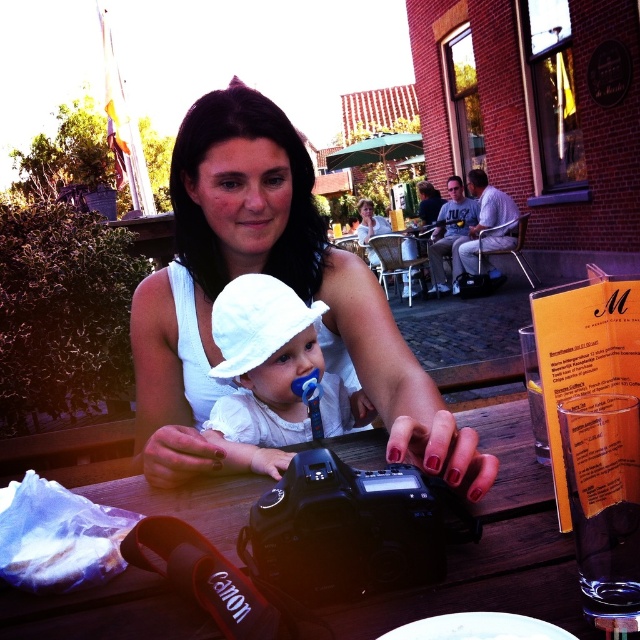
Does wooden table at center have a lesser width compared to white fabric hat at center?

No.

Between point (488, 406) and point (250, 301), which one is positioned behind?

Positioned behind is point (488, 406).

In order to click on wooden table at center in this screenshot , I will do `click(492, 547)`.

Consider the image. Which of these two, white matte shirt at center or white paper bag at lower left, stands taller?

white matte shirt at center is taller.

What do you see at coordinates (282, 280) in the screenshot?
I see `white matte shirt at center` at bounding box center [282, 280].

Locate an element on the screen. This screenshot has width=640, height=640. white matte shirt at center is located at coordinates (282, 280).

The width and height of the screenshot is (640, 640). What do you see at coordinates (492, 547) in the screenshot? I see `wooden table at center` at bounding box center [492, 547].

Is wooden table at center closer to the viewer compared to white paper bag at lower left?

Yes, it is.

This screenshot has height=640, width=640. What do you see at coordinates (492, 547) in the screenshot?
I see `wooden table at center` at bounding box center [492, 547].

You are a GUI agent. You are given a task and a screenshot of the screen. Output one action in this format:
    pyautogui.click(x=<x>, y=<y>)
    Task: Click on the wooden table at center
    The height and width of the screenshot is (640, 640).
    Given the screenshot: What is the action you would take?
    pyautogui.click(x=492, y=547)